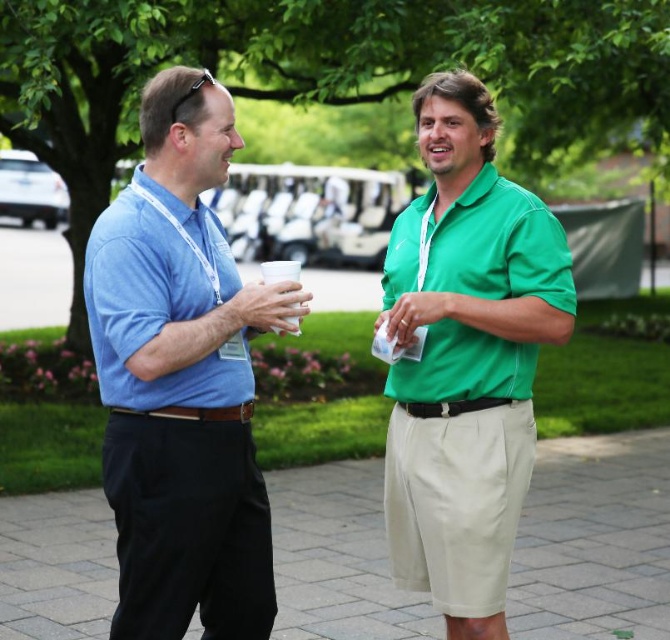
Does green smooth polo shirt at right have a greater width compared to matte blue polo shirt at left?

Indeed, green smooth polo shirt at right has a greater width compared to matte blue polo shirt at left.

Does green smooth polo shirt at right have a lesser height compared to matte blue polo shirt at left?

Incorrect, green smooth polo shirt at right's height does not fall short of matte blue polo shirt at left's.

Locate an element on the screen. The width and height of the screenshot is (670, 640). green smooth polo shirt at right is located at coordinates (480, 246).

Can you confirm if green leafy tree at upper center is positioned to the left of matte blue shirt at left?

No, green leafy tree at upper center is not to the left of matte blue shirt at left.

Does green leafy tree at upper center appear on the right side of matte blue shirt at left?

Correct, you'll find green leafy tree at upper center to the right of matte blue shirt at left.

This screenshot has width=670, height=640. What do you see at coordinates (324, 72) in the screenshot?
I see `green leafy tree at upper center` at bounding box center [324, 72].

You are a GUI agent. You are given a task and a screenshot of the screen. Output one action in this format:
    pyautogui.click(x=<x>, y=<y>)
    Task: Click on the green leafy tree at upper center
    
    Given the screenshot: What is the action you would take?
    pyautogui.click(x=324, y=72)

Does matte blue shirt at left appear on the left side of matte green polo shirt at right?

Correct, you'll find matte blue shirt at left to the left of matte green polo shirt at right.

Which is in front, point (237, 134) or point (517, 257)?

Point (237, 134)

You are a GUI agent. You are given a task and a screenshot of the screen. Output one action in this format:
    pyautogui.click(x=<x>, y=<y>)
    Task: Click on the matte blue shirt at left
    The height and width of the screenshot is (640, 670).
    Given the screenshot: What is the action you would take?
    pyautogui.click(x=182, y=378)